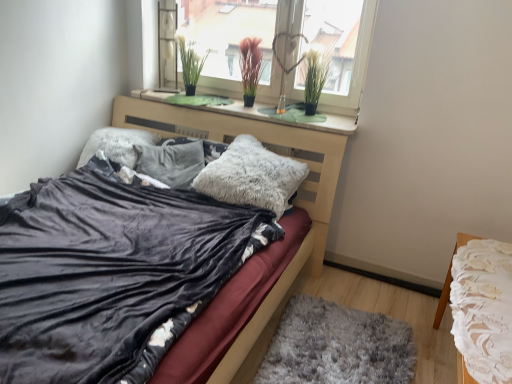
Question: Which direction should I rotate to face fuzzy gray pillow at center, which is counted as the third pillow, starting from the left, — up or down?

Choices:
 (A) up
 (B) down

Answer: (A)

Question: Can you see green grass-like plant at upper center, acting as the 3th plant starting from the right, touching gray shaggy rug at lower center?

Choices:
 (A) yes
 (B) no

Answer: (B)

Question: Could you tell me if green grass-like plant at upper center, acting as the 3th plant starting from the right, is facing gray shaggy rug at lower center?

Choices:
 (A) yes
 (B) no

Answer: (B)

Question: Does green grass-like plant at upper center, which is the first plant in left-to-right order, have a greater height compared to gray shaggy rug at lower center?

Choices:
 (A) no
 (B) yes

Answer: (B)

Question: From the image's perspective, is green grass-like plant at upper center, which is the first plant in left-to-right order, under gray shaggy rug at lower center?

Choices:
 (A) yes
 (B) no

Answer: (B)

Question: Considering the relative positions of green grass-like plant at upper center, which is the first plant in left-to-right order, and gray shaggy rug at lower center in the image provided, is green grass-like plant at upper center, which is the first plant in left-to-right order, to the left of gray shaggy rug at lower center from the viewer's perspective?

Choices:
 (A) yes
 (B) no

Answer: (A)

Question: Is gray shaggy rug at lower center surrounded by green grass-like plant at upper center, which is the first plant in left-to-right order?

Choices:
 (A) yes
 (B) no

Answer: (B)

Question: Could green grass-like plant at upper center, which is the first plant in left-to-right order, be considered to be inside fuzzy white pillow at center, which ranks as the 2th pillow in left-to-right order?

Choices:
 (A) no
 (B) yes

Answer: (A)

Question: From a real-world perspective, is fuzzy white pillow at center, the second pillow viewed from the right, physically above green grass-like plant at upper center, which is the first plant in left-to-right order?

Choices:
 (A) no
 (B) yes

Answer: (A)

Question: Is fuzzy white pillow at center, which ranks as the 2th pillow in left-to-right order, taller than green grass-like plant at upper center, which is the first plant in left-to-right order?

Choices:
 (A) no
 (B) yes

Answer: (A)

Question: From the image's perspective, would you say fuzzy white pillow at center, which ranks as the 2th pillow in left-to-right order, is positioned over green grass-like plant at upper center, which is the first plant in left-to-right order?

Choices:
 (A) yes
 (B) no

Answer: (B)

Question: Is fuzzy white pillow at center, the second pillow viewed from the right, next to green grass-like plant at upper center, which is the first plant in left-to-right order?

Choices:
 (A) no
 (B) yes

Answer: (A)

Question: Does fuzzy white pillow at center, which ranks as the 2th pillow in left-to-right order, have a lesser width compared to green grass-like plant at upper center, which is the first plant in left-to-right order?

Choices:
 (A) yes
 (B) no

Answer: (B)

Question: From a real-world perspective, is fuzzy white pillow at center, which ranks as the 2th pillow in left-to-right order, below velvet black bed at center?

Choices:
 (A) no
 (B) yes

Answer: (A)